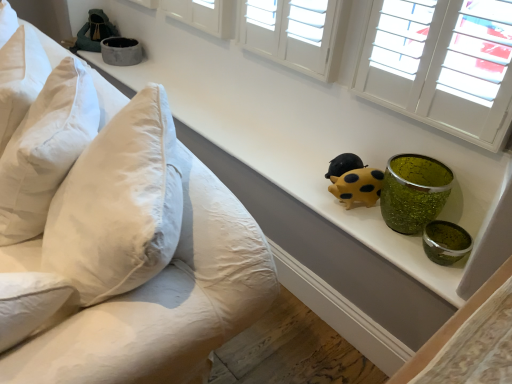
Question: Is matte gray bowl at upper left at the right side of white cotton pillow at left, positioned as the 2th pillow in top-to-bottom order?

Choices:
 (A) no
 (B) yes

Answer: (B)

Question: Is matte gray bowl at upper left completely or partially outside of white cotton pillow at left, marked as the first pillow in a bottom-to-top arrangement?

Choices:
 (A) yes
 (B) no

Answer: (A)

Question: Does matte gray bowl at upper left have a greater width compared to white cotton pillow at left, positioned as the 2th pillow in top-to-bottom order?

Choices:
 (A) no
 (B) yes

Answer: (A)

Question: Could you tell me if matte gray bowl at upper left is facing white cotton pillow at left, positioned as the 2th pillow in top-to-bottom order?

Choices:
 (A) no
 (B) yes

Answer: (A)

Question: From a real-world perspective, is matte gray bowl at upper left over white cotton pillow at left, positioned as the 2th pillow in top-to-bottom order?

Choices:
 (A) yes
 (B) no

Answer: (B)

Question: From the image's perspective, relative to white cotton pillow at left, positioned as the 2th pillow in top-to-bottom order, is white cotton pillows at left above or below?

Choices:
 (A) below
 (B) above

Answer: (A)

Question: Considering the positions of white cotton pillows at left and white cotton pillow at left, positioned as the 2th pillow in top-to-bottom order, in the image, is white cotton pillows at left taller or shorter than white cotton pillow at left, positioned as the 2th pillow in top-to-bottom order,?

Choices:
 (A) short
 (B) tall

Answer: (B)

Question: Considering the positions of white cotton pillows at left and white cotton pillow at left, positioned as the 2th pillow in top-to-bottom order, in the image, is white cotton pillows at left wider or thinner than white cotton pillow at left, positioned as the 2th pillow in top-to-bottom order,?

Choices:
 (A) thin
 (B) wide

Answer: (B)

Question: Considering the relative positions of white cotton pillows at left and white cotton pillow at left, marked as the first pillow in a bottom-to-top arrangement, in the image provided, is white cotton pillows at left to the left or to the right of white cotton pillow at left, marked as the first pillow in a bottom-to-top arrangement,?

Choices:
 (A) right
 (B) left

Answer: (B)

Question: Is matte gray bowl at upper left taller or shorter than yellow matte pig at center, which ranks as the 2th toy in top-to-bottom order?

Choices:
 (A) tall
 (B) short

Answer: (B)

Question: From a real-world perspective, is matte gray bowl at upper left physically located above or below yellow matte pig at center, acting as the 1th toy starting from the bottom?

Choices:
 (A) above
 (B) below

Answer: (B)

Question: From the image's perspective, is matte gray bowl at upper left positioned above or below yellow matte pig at center, positioned as the first toy in right-to-left order?

Choices:
 (A) below
 (B) above

Answer: (B)

Question: Considering the positions of matte gray bowl at upper left and yellow matte pig at center, the first toy when ordered from front to back, in the image, is matte gray bowl at upper left wider or thinner than yellow matte pig at center, the first toy when ordered from front to back,?

Choices:
 (A) thin
 (B) wide

Answer: (B)

Question: Considering the positions of point (89, 135) and point (349, 162), is point (89, 135) closer or farther from the camera than point (349, 162)?

Choices:
 (A) farther
 (B) closer

Answer: (B)

Question: Is white cotton pillow at left, marked as the first pillow in a bottom-to-top arrangement, inside the boundaries of yellow matte pig at center, acting as the 1th toy starting from the bottom, or outside?

Choices:
 (A) outside
 (B) inside

Answer: (A)